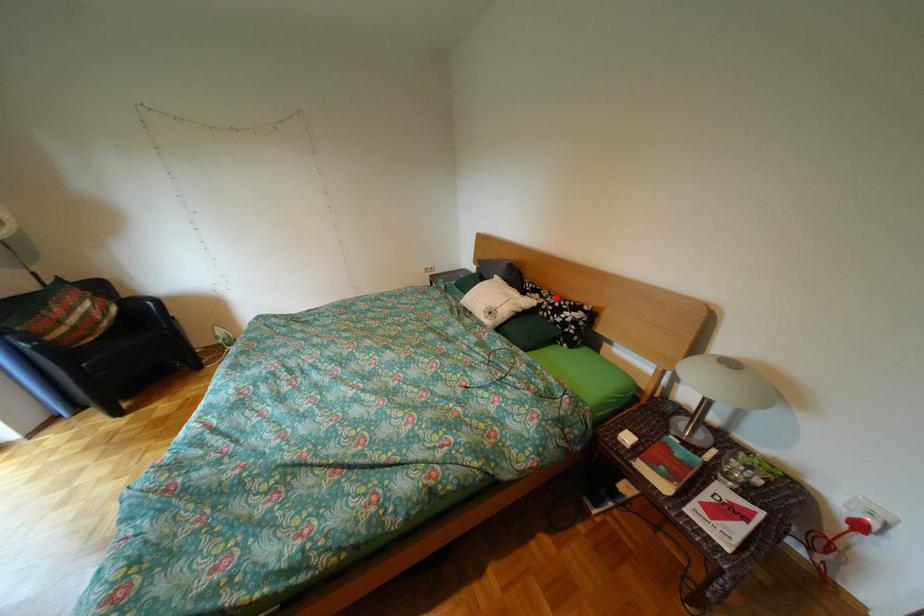
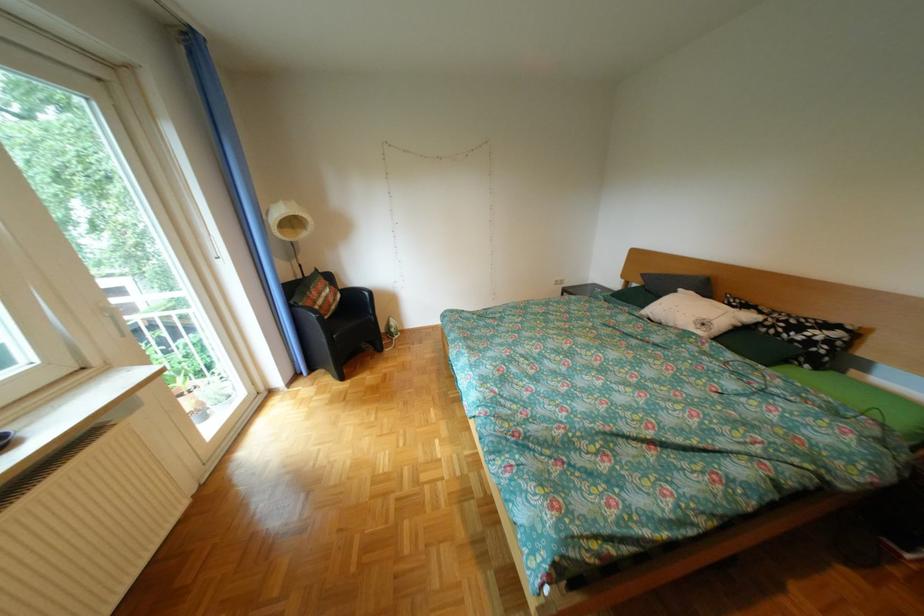
Where in the second image is the point corresponding to the highlighted location from the first image?

(775, 313)